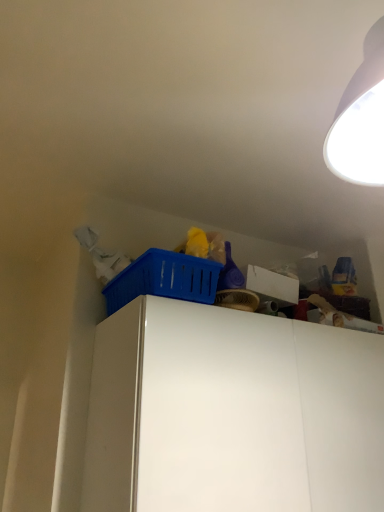
Question: Choose the correct answer: Is white matte cabinet at upper right inside blue plastic basket at upper center or outside it?

Choices:
 (A) inside
 (B) outside

Answer: (B)

Question: Looking at the image, does white matte cabinet at upper right seem bigger or smaller compared to blue plastic basket at upper center?

Choices:
 (A) big
 (B) small

Answer: (A)

Question: In terms of width, does white matte cabinet at upper right look wider or thinner when compared to blue plastic basket at upper center?

Choices:
 (A) thin
 (B) wide

Answer: (B)

Question: From their relative heights in the image, would you say blue plastic basket at upper center is taller or shorter than white matte cabinet at upper right?

Choices:
 (A) short
 (B) tall

Answer: (A)

Question: From a real-world perspective, is blue plastic basket at upper center positioned above or below white matte cabinet at upper right?

Choices:
 (A) above
 (B) below

Answer: (A)

Question: Is point (148, 267) closer or farther from the camera than point (279, 397)?

Choices:
 (A) closer
 (B) farther

Answer: (A)

Question: Is blue plastic basket at upper center spatially inside white matte cabinet at upper right, or outside of it?

Choices:
 (A) inside
 (B) outside

Answer: (B)